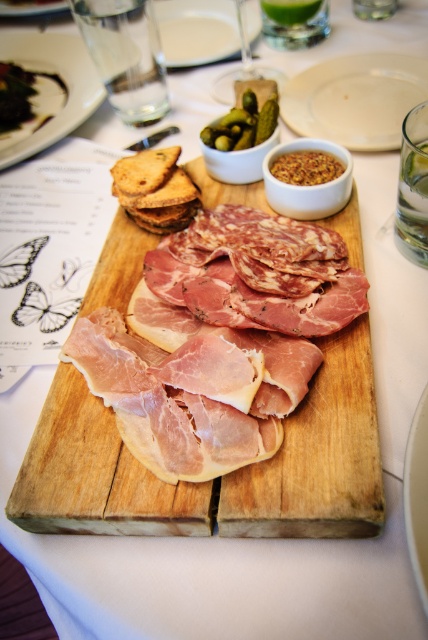
You are setting up a dining table and need to place a decorative vase between the white porcelain plate at upper center and the white glossy plate at center. According to the image, where should you position the vase to ensure it is between them?

The white porcelain plate at upper center is located above the white glossy plate at center, so you should place the vase between them vertically, positioning it below the white porcelain plate at upper center and above the white glossy plate at center.

You are standing at the edge of the table looking at the charcuterie board. There are two points marked on the board. Which point is closer to you, point (369, 100) or point (285, 172)?

Point (285, 172) is closer to you because it is in front of point (369, 100).

You are a chef preparing a dish and need to choose between the white porcelain plate at upper center and the white glossy plate at center. Which plate is taller?

The white porcelain plate at upper center is much taller than the white glossy plate at center.